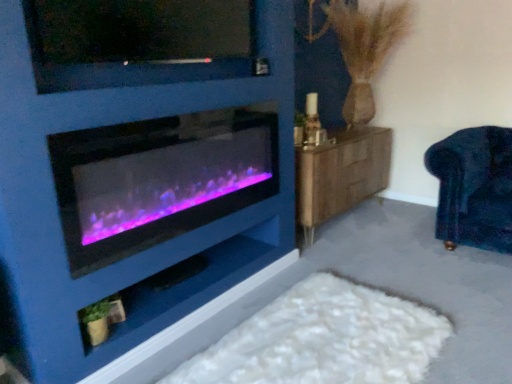
Where is `free space that is in between velvet dark blue armchair at right and white fluffy rug at lower center`? The width and height of the screenshot is (512, 384). free space that is in between velvet dark blue armchair at right and white fluffy rug at lower center is located at coordinates (428, 270).